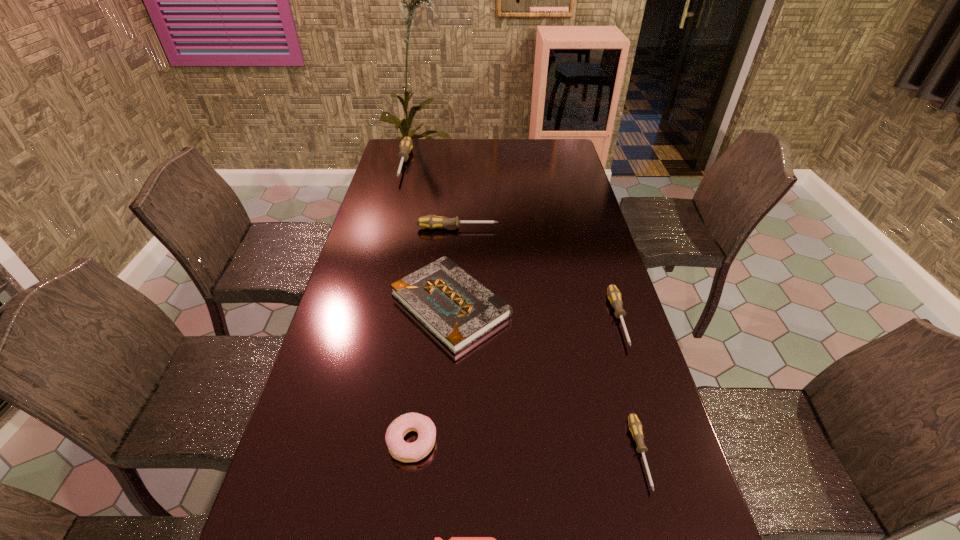
In order to click on the tallest screwdriver in this screenshot , I will do `click(406, 145)`.

Where is `the farthest object`? the farthest object is located at coordinates (406, 145).

You are a GUI agent. You are given a task and a screenshot of the screen. Output one action in this format:
    pyautogui.click(x=<x>, y=<y>)
    Task: Click on the third gray screwdriver from right to left
    
    Given the screenshot: What is the action you would take?
    pyautogui.click(x=431, y=221)

You are a GUI agent. You are given a task and a screenshot of the screen. Output one action in this format:
    pyautogui.click(x=<x>, y=<y>)
    Task: Click on the second tallest screwdriver
    This screenshot has height=540, width=960.
    Given the screenshot: What is the action you would take?
    pyautogui.click(x=431, y=221)

Find the location of a particular element. This screenshot has width=960, height=540. notebook is located at coordinates (457, 309).

Where is `pink doughnut`? pink doughnut is located at coordinates (400, 450).

You are a GUI agent. You are given a task and a screenshot of the screen. Output one action in this format:
    pyautogui.click(x=<x>, y=<y>)
    Task: Click on the third farthest screwdriver
    
    Given the screenshot: What is the action you would take?
    pyautogui.click(x=614, y=295)

The width and height of the screenshot is (960, 540). In order to click on the second nearest gray screwdriver in this screenshot , I will do `click(614, 295)`.

Identify the location of the fourth screwdriver from left to right. The image size is (960, 540). (635, 426).

Where is `the nearest gray screwdriver`? the nearest gray screwdriver is located at coordinates (635, 426).